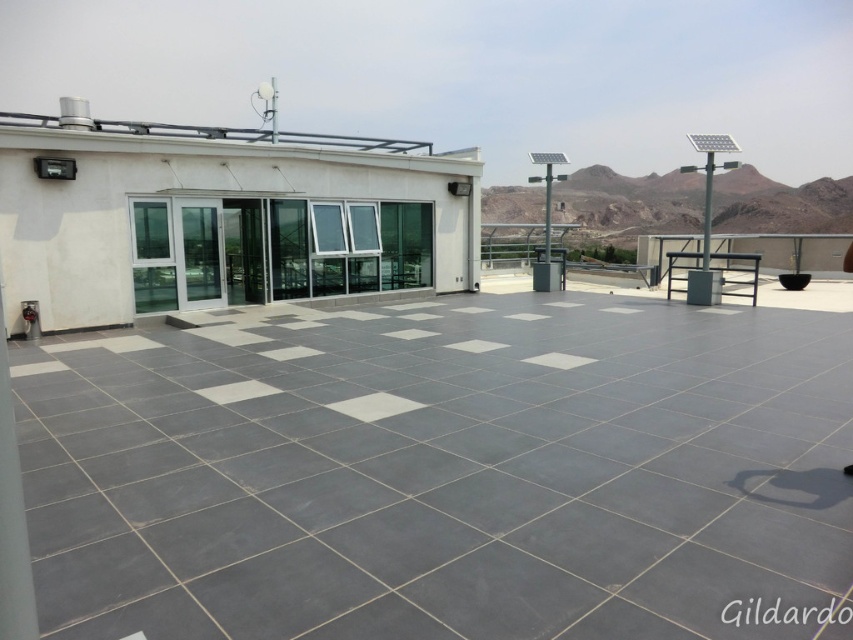
Between gray tile at center and white glass terrace at upper left, which one is positioned higher?

Positioned higher is white glass terrace at upper left.

Does gray tile at center have a lesser height compared to white glass terrace at upper left?

Indeed, gray tile at center has a lesser height compared to white glass terrace at upper left.

Is point (120, 525) closer to viewer compared to point (103, 182)?

Yes, point (120, 525) is in front of point (103, 182).

Where is `gray tile at center`? gray tile at center is located at coordinates (442, 468).